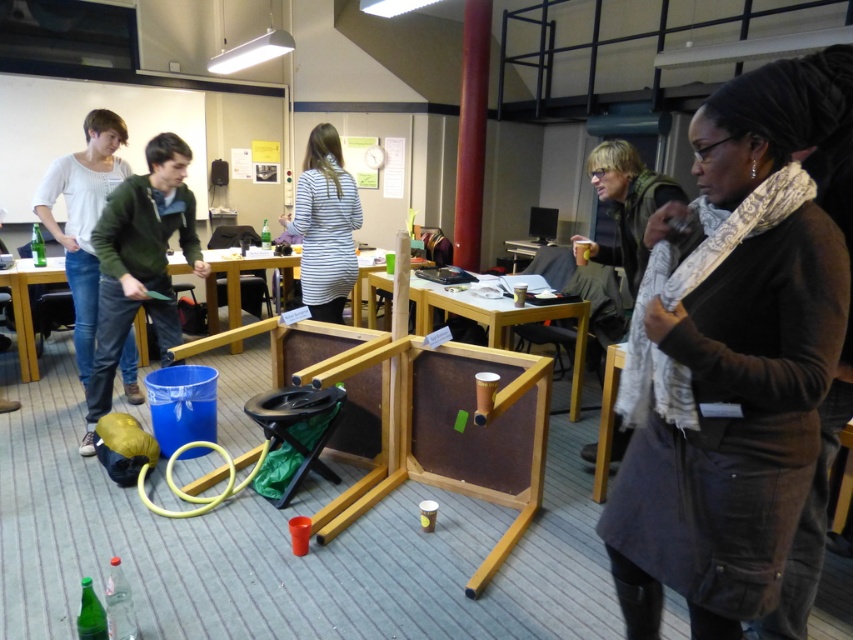
Question: Is brown wood table at center below wooden table at center?

Choices:
 (A) yes
 (B) no

Answer: (A)

Question: Observing the image, what is the correct spatial positioning of dark gray corduroy coat at center in reference to wooden table at center?

Choices:
 (A) right
 (B) left

Answer: (A)

Question: Which object is the farthest from the wooden table at center?

Choices:
 (A) green matte jacket at left
 (B) brown wood table at center
 (C) dark gray corduroy coat at center

Answer: (C)

Question: Which point is farther to the camera?

Choices:
 (A) (148, 228)
 (B) (820, 362)
 (C) (505, 308)
 (D) (347, 273)

Answer: (D)

Question: Among these points, which one is nearest to the camera?

Choices:
 (A) (541, 316)
 (B) (698, 468)
 (C) (354, 224)

Answer: (B)

Question: Can you confirm if dark gray corduroy coat at center is positioned to the right of green matte jacket at left?

Choices:
 (A) yes
 (B) no

Answer: (A)